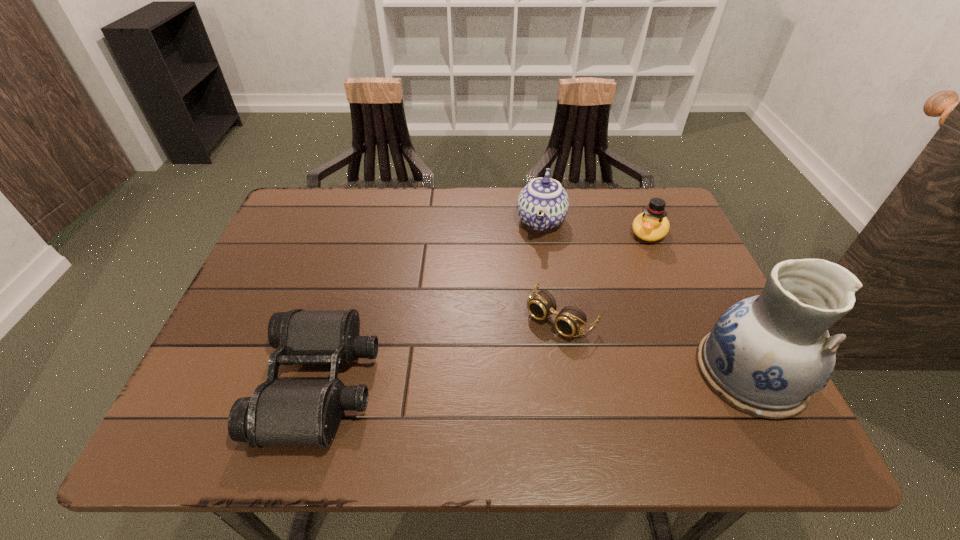
I want to click on free space on the desktop that is between the second shortest object and the tallest object and is positioned from the spout of the chinaware, so click(502, 379).

This screenshot has height=540, width=960. Identify the location of free spot on the desktop that is between the binoculars and the pottery and is positioned on the front-facing side of the third shortest object. (566, 377).

This screenshot has width=960, height=540. Find the location of `free space on the desktop that is between the second shortest object and the tallest object and is positioned through the lenses of the shortest object`. free space on the desktop that is between the second shortest object and the tallest object and is positioned through the lenses of the shortest object is located at coordinates (503, 379).